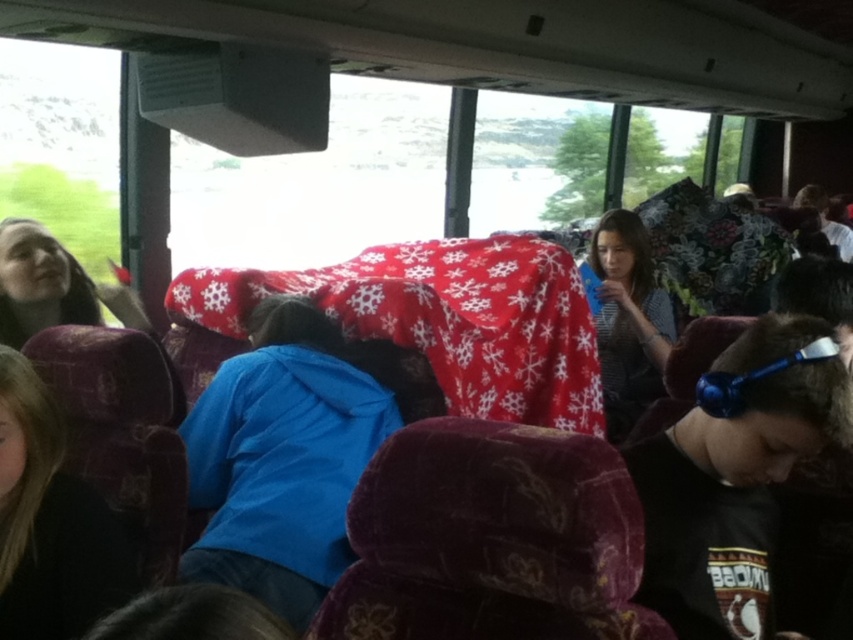
Question: Which object is positioned farthest from the blue fleece jacket at center?

Choices:
 (A) blue metallic headphones at lower right
 (B) dark brown leather jacket at lower left

Answer: (A)

Question: Can you confirm if blue fleece jacket at center is bigger than dark brown leather jacket at lower left?

Choices:
 (A) no
 (B) yes

Answer: (B)

Question: Which of these objects is positioned closest to the dark brown leather jacket at lower left?

Choices:
 (A) blue fleece jacket at center
 (B) blue metallic headphones at lower right

Answer: (A)

Question: Estimate the real-world distances between objects in this image. Which object is closer to the blue fleece jacket at center?

Choices:
 (A) dark brown leather jacket at lower left
 (B) blue metallic headphones at lower right

Answer: (A)

Question: Can you confirm if blue metallic headphones at lower right is bigger than dark brown leather jacket at lower left?

Choices:
 (A) no
 (B) yes

Answer: (B)

Question: Is blue fleece jacket at center further to camera compared to dark brown leather jacket at lower left?

Choices:
 (A) no
 (B) yes

Answer: (B)